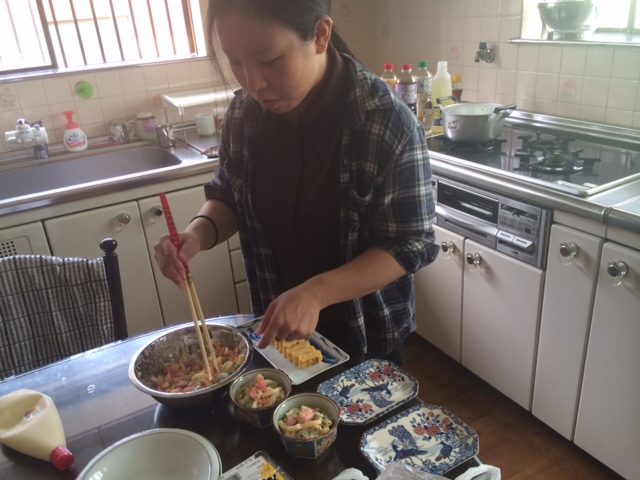
At what (x,y) coordinates should I click in order to perform the action: click on kitchen cabinets. Please return your answer as a coordinate pair (x, y). This screenshot has width=640, height=480. Looking at the image, I should click on (598, 398), (562, 375), (505, 333), (438, 305), (172, 305), (138, 298).